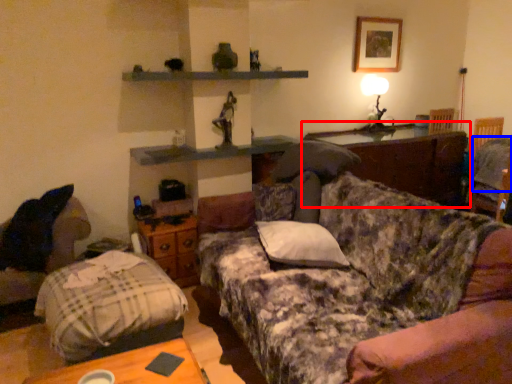
Question: Which object appears farthest to the camera in this image, table (highlighted by a red box) or pillow (highlighted by a blue box)?

Choices:
 (A) table
 (B) pillow

Answer: (A)